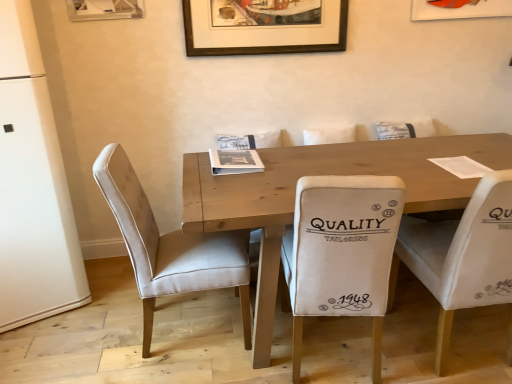
Question: Does point (376, 140) appear closer or farther from the camera than point (15, 317)?

Choices:
 (A) closer
 (B) farther

Answer: (B)

Question: Do you think wooden table at center is within white matte refrigerator at left, or outside of it?

Choices:
 (A) outside
 (B) inside

Answer: (A)

Question: Which is farther from the white fabric chair at right, arranged as the 3th chair when viewed from the left?

Choices:
 (A) wooden table at center
 (B) white matte refrigerator at left
 (C) beige velvet chair at left, which is the first chair from left to right
 (D) brown wooden picture frame at upper center
 (E) beige fabric chair at center, positioned as the second chair in left-to-right order

Answer: (B)

Question: Which is farther from the beige fabric chair at center, positioned as the second chair in left-to-right order?

Choices:
 (A) wooden table at center
 (B) white matte refrigerator at left
 (C) beige velvet chair at left, positioned as the 3th chair in right-to-left order
 (D) white fabric chair at right, arranged as the 3th chair when viewed from the left
 (E) brown wooden picture frame at upper center

Answer: (E)